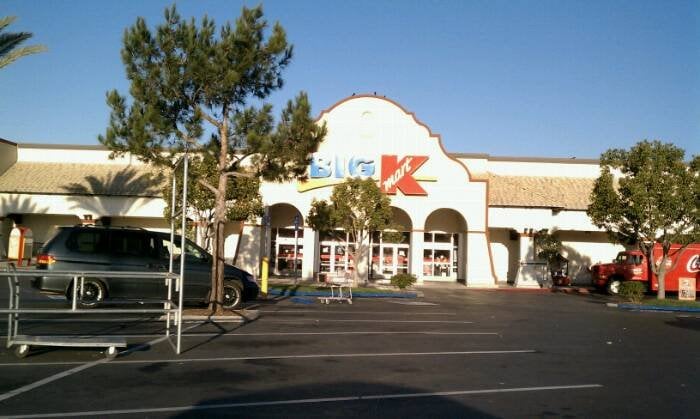
This screenshot has width=700, height=419. Find the location of `van sliding door`. van sliding door is located at coordinates (131, 272).